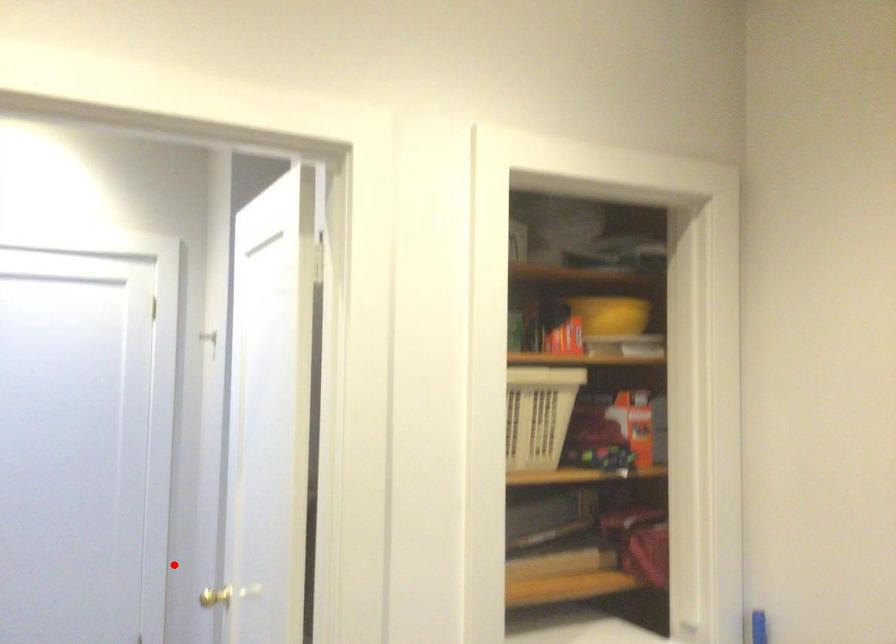
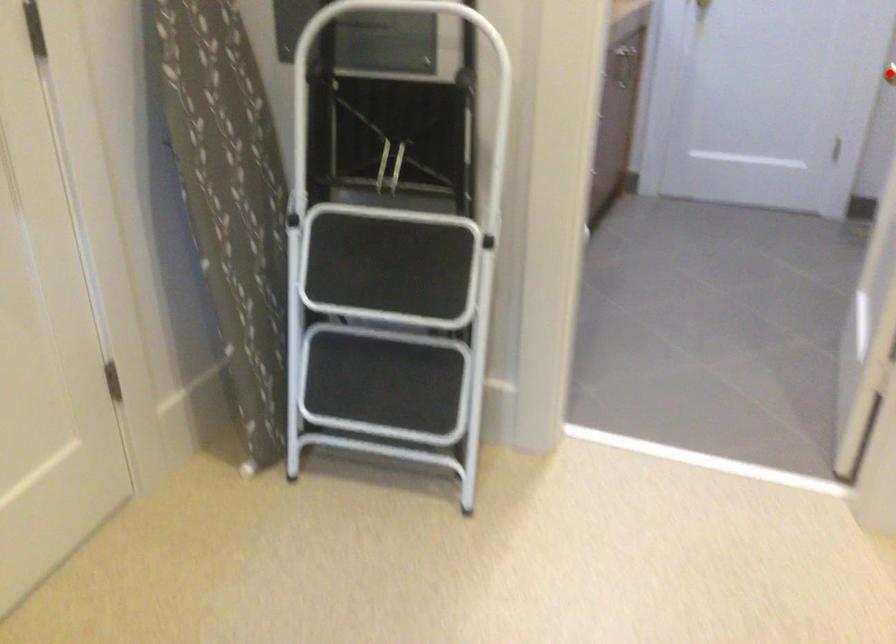
I am providing you with two images of the same scene from different viewpoints. A red point is marked on the first image and another point is marked on the second image. Does the point marked in image1 correspond to the same location as the one in image2?

Yes